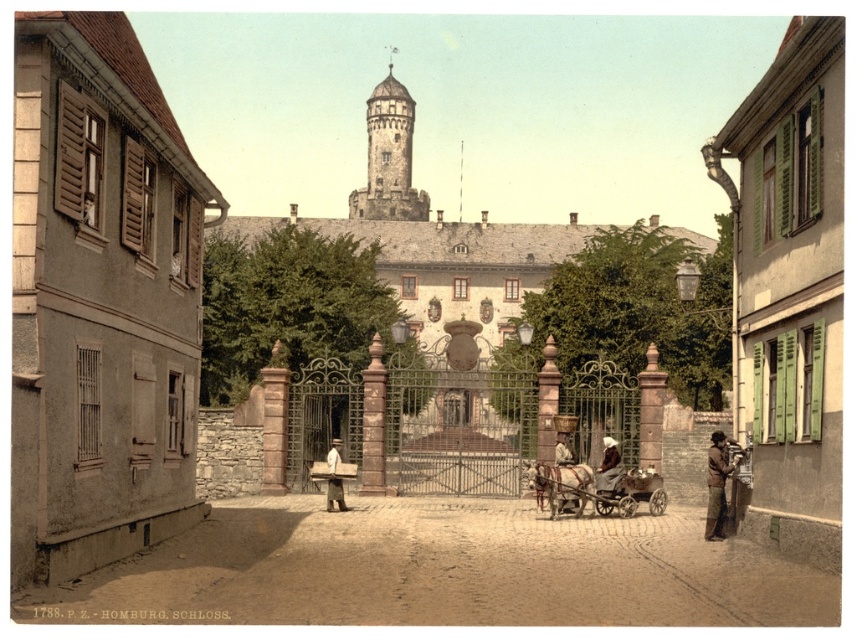
Question: Which point is closer to the camera?

Choices:
 (A) (712, 484)
 (B) (556, 444)

Answer: (A)

Question: Which point is farther to the camera?

Choices:
 (A) (606, 470)
 (B) (546, 563)

Answer: (A)

Question: Based on their relative distances, which object is nearer to the brown leather jacket at lower right?

Choices:
 (A) brown cobblestone alley at center
 (B) brown stone tower at center
 (C) wooden cart at center

Answer: (C)

Question: Where is brown cobblestone alley at center located in relation to brown leather jacket at lower right in the image?

Choices:
 (A) below
 (B) above

Answer: (A)

Question: Does brown leather coat at center have a lesser width compared to light brown fur coat at center?

Choices:
 (A) no
 (B) yes

Answer: (A)

Question: Is brown stone tower at center wider than brown leather hat at center?

Choices:
 (A) no
 (B) yes

Answer: (B)